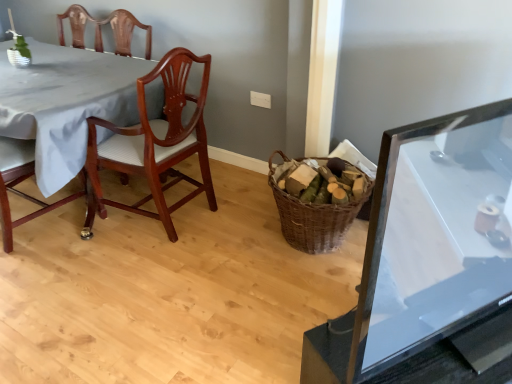
Question: From the image's perspective, is transparent glass table at right, the first table in the front-to-back sequence, above white fabric table at left, the 2th table from the front?

Choices:
 (A) yes
 (B) no

Answer: (B)

Question: Is transparent glass table at right, the first table in the front-to-back sequence, not close to white fabric table at left, positioned as the first table in left-to-right order?

Choices:
 (A) yes
 (B) no

Answer: (A)

Question: Is transparent glass table at right, the first table in the front-to-back sequence, positioned before white fabric table at left, the first table positioned from the back?

Choices:
 (A) yes
 (B) no

Answer: (A)

Question: Is white fabric table at left, which ranks as the second table in right-to-left order, completely or partially inside transparent glass table at right, which is counted as the 2th table, starting from the back?

Choices:
 (A) no
 (B) yes

Answer: (A)

Question: Considering the relative positions of transparent glass table at right, placed as the first table when sorted from right to left, and white fabric table at left, which ranks as the second table in right-to-left order, in the image provided, is transparent glass table at right, placed as the first table when sorted from right to left, to the right of white fabric table at left, which ranks as the second table in right-to-left order, from the viewer's perspective?

Choices:
 (A) no
 (B) yes

Answer: (B)

Question: Is transparent glass table at right, which is counted as the 2th table, starting from the back, oriented away from white fabric table at left, positioned as the first table in left-to-right order?

Choices:
 (A) yes
 (B) no

Answer: (A)

Question: Is transparent glass table at right, which is counted as the 2th table, starting from the back, shorter than mahogany wood chair at left, the second chair in the right-to-left sequence?

Choices:
 (A) no
 (B) yes

Answer: (B)

Question: Is transparent glass table at right, which is counted as the 2th table, starting from the back, placed right next to mahogany wood chair at left, the second chair in the right-to-left sequence?

Choices:
 (A) no
 (B) yes

Answer: (A)

Question: Is transparent glass table at right, which ranks as the 2th table in left-to-right order, to the left of mahogany wood chair at left, which is counted as the 1th chair, starting from the left, from the viewer's perspective?

Choices:
 (A) yes
 (B) no

Answer: (B)

Question: Is there a large distance between transparent glass table at right, placed as the first table when sorted from right to left, and mahogany wood chair at left, the second chair in the right-to-left sequence?

Choices:
 (A) no
 (B) yes

Answer: (B)

Question: From the image's perspective, is transparent glass table at right, which is counted as the 2th table, starting from the back, on top of mahogany wood chair at left, the second chair in the right-to-left sequence?

Choices:
 (A) no
 (B) yes

Answer: (A)

Question: Can mahogany wood chair at left, the second chair in the right-to-left sequence, be found inside transparent glass table at right, which is counted as the 2th table, starting from the back?

Choices:
 (A) no
 (B) yes

Answer: (A)

Question: Are mahogany wood chair at left, the second chair in the right-to-left sequence, and woven brown basket at center making contact?

Choices:
 (A) no
 (B) yes

Answer: (A)